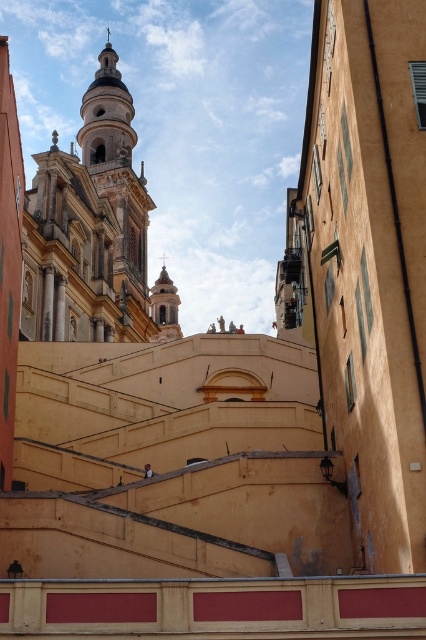
Question: Can you confirm if white marble church at upper center is wider than smooth white tower at center?

Choices:
 (A) no
 (B) yes

Answer: (B)

Question: Is white marble church at upper center positioned behind smooth white tower at center?

Choices:
 (A) yes
 (B) no

Answer: (B)

Question: Among these points, which one is nearest to the camera?

Choices:
 (A) (124, 278)
 (B) (157, 333)

Answer: (A)

Question: Which of the following is the closest to the observer?

Choices:
 (A) white marble church at upper center
 (B) smooth white tower at center

Answer: (A)

Question: Is white marble church at upper center thinner than smooth white tower at center?

Choices:
 (A) no
 (B) yes

Answer: (A)